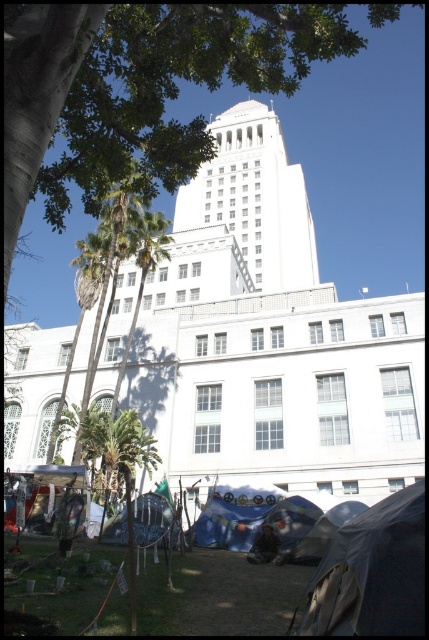
Is point (205, 209) farther from camera compared to point (302, 561)?

Yes, point (205, 209) is behind point (302, 561).

Is white marble tower at center taller than transparent plastic tent at lower center?

Yes, white marble tower at center is taller than transparent plastic tent at lower center.

Is point (244, 236) more distant than point (314, 556)?

Yes, point (244, 236) is behind point (314, 556).

In order to click on white marble tower at center in this screenshot , I will do `click(253, 198)`.

In the scene shown: Does white marble tower at center have a smaller size compared to dark gray fabric tent at lower right?

No.

Which is behind, point (271, 262) or point (420, 516)?

Positioned behind is point (271, 262).

Identify the location of white marble tower at center. Image resolution: width=429 pixels, height=640 pixels. (253, 198).

Can you confirm if green leafy tree at upper left is bigger than dark gray fabric tent at lower right?

Correct, green leafy tree at upper left is larger in size than dark gray fabric tent at lower right.

Can you confirm if green leafy tree at upper left is positioned above dark gray fabric tent at lower right?

Yes.

Does point (386, 205) lie behind point (405, 609)?

That is True.

In order to click on green leafy tree at upper left in this screenshot , I will do `click(365, 154)`.